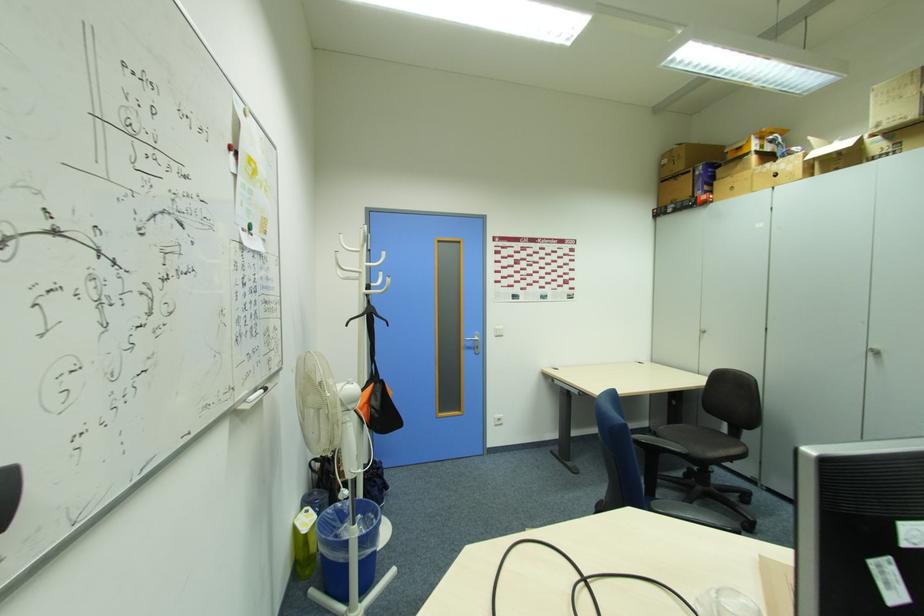
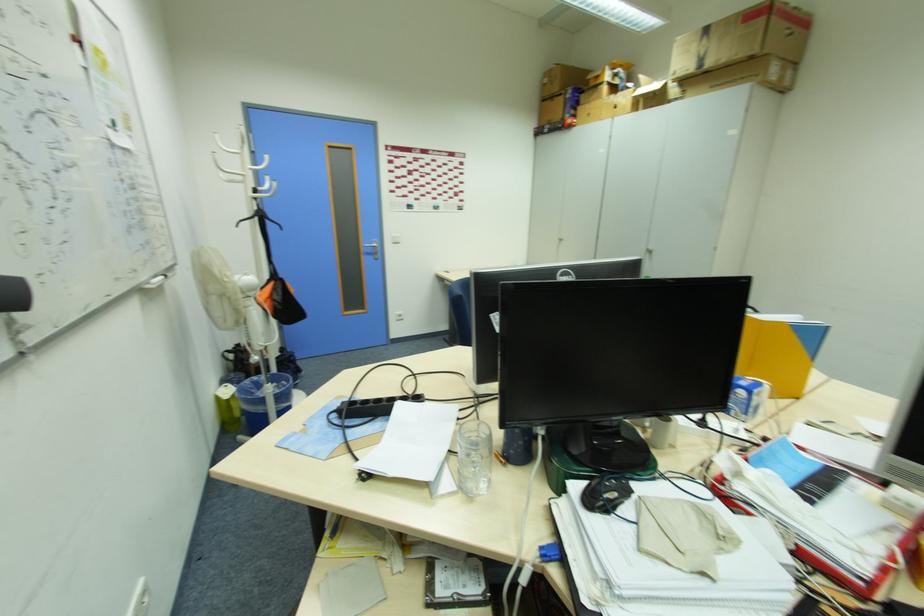
Find the pixel in the second image that matches the point at 299,530 in the first image.

(220, 400)